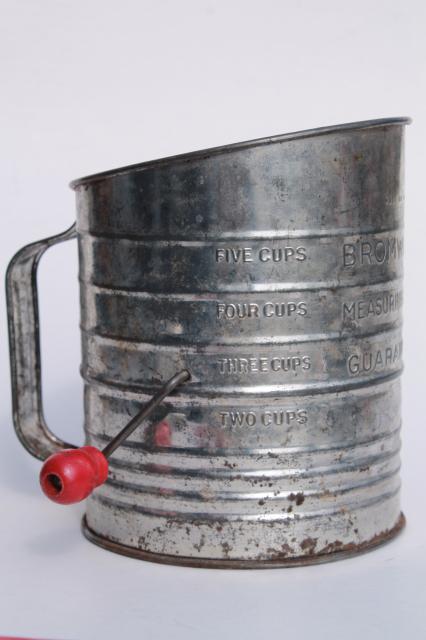
Locate an element on the screen. The height and width of the screenshot is (640, 426). surface is located at coordinates (155, 612).